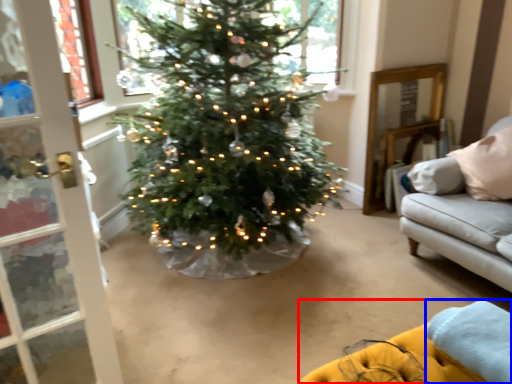
Question: Which point is further to the camera, couch (highlighted by a red box) or blanket (highlighted by a blue box)?

Choices:
 (A) couch
 (B) blanket

Answer: (B)